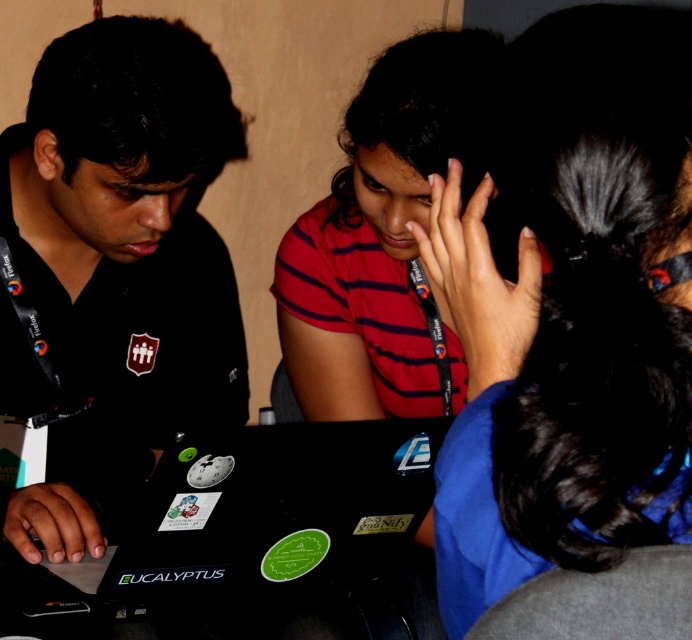
Question: Is black matte shirt at left to the left of black matte laptop at center from the viewer's perspective?

Choices:
 (A) yes
 (B) no

Answer: (A)

Question: Among these points, which one is nearest to the camera?

Choices:
 (A) (183, 540)
 (B) (197, 49)
 (C) (437, 582)
 (D) (373, 408)

Answer: (C)

Question: Based on their relative distances, which object is farther from the black matte laptop at center?

Choices:
 (A) black matte shirt at left
 (B) black glossy hair at upper right

Answer: (B)

Question: Considering the relative positions of black matte shirt at left and black matte laptop at center in the image provided, where is black matte shirt at left located with respect to black matte laptop at center?

Choices:
 (A) below
 (B) above

Answer: (B)

Question: Is red striped shirt at center to the left of black matte laptop at center from the viewer's perspective?

Choices:
 (A) yes
 (B) no

Answer: (B)

Question: Among these points, which one is farthest from the camera?

Choices:
 (A) (635, 400)
 (B) (316, 237)
 (C) (221, 330)
 (D) (194, 531)

Answer: (C)